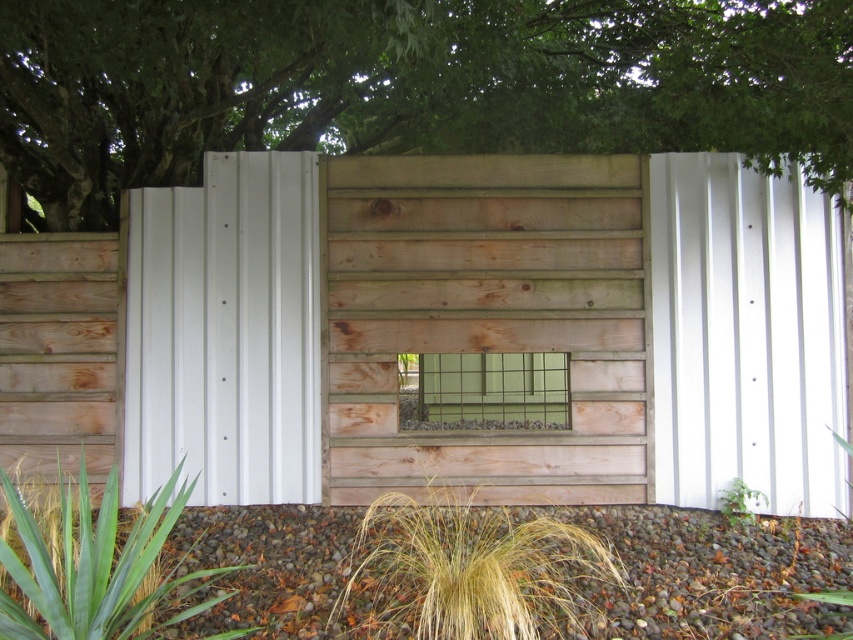
Question: Is green leafy tree at upper center closer to camera compared to green leafy plant at lower right?

Choices:
 (A) yes
 (B) no

Answer: (A)

Question: Does green leafy tree at upper center have a greater width compared to green leafy plant at lower right?

Choices:
 (A) yes
 (B) no

Answer: (A)

Question: Which point appears farthest from the camera in this image?

Choices:
 (A) (575, 554)
 (B) (148, 611)
 (C) (723, 504)

Answer: (C)

Question: Which object is positioned farthest from the green leafy tree at upper center?

Choices:
 (A) green leafy grass at lower left
 (B) green leafy plant at lower right
 (C) golden grass at center

Answer: (B)

Question: Does green leafy tree at upper center have a greater width compared to green leafy grass at lower left?

Choices:
 (A) no
 (B) yes

Answer: (B)

Question: Estimate the real-world distances between objects in this image. Which object is farther from the golden grass at center?

Choices:
 (A) green leafy plant at lower right
 (B) green leafy grass at lower left

Answer: (A)